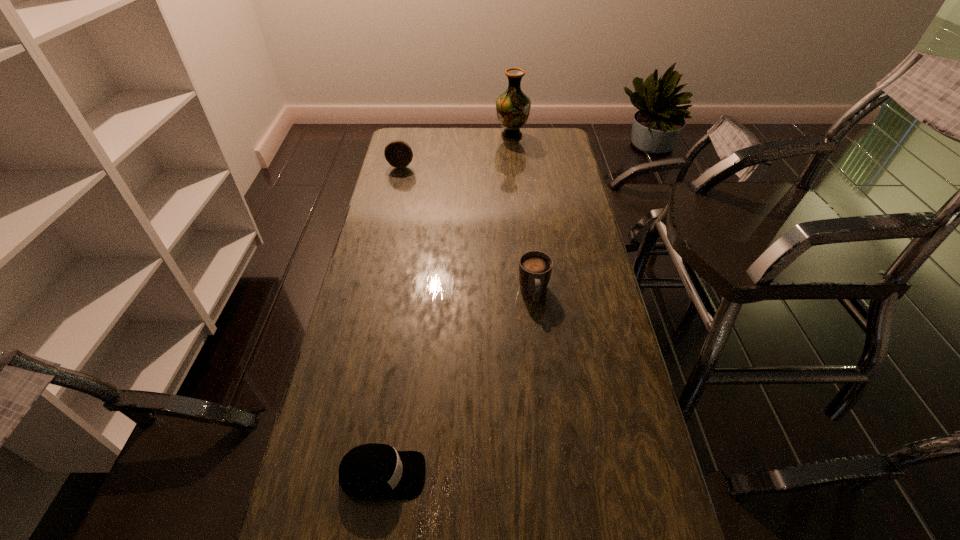
Find the location of a particular element. This screenshot has height=540, width=960. object positioned at the far edge is located at coordinates (513, 107).

This screenshot has height=540, width=960. Identify the location of bowl that is at the left edge. (398, 153).

At what (x,y) coordinates should I click in order to perform the action: click on cap that is at the left edge. Please return your answer as a coordinate pair (x, y). Looking at the image, I should click on (373, 471).

Image resolution: width=960 pixels, height=540 pixels. In the image, there is a desktop. Find the location of `free region at the left edge`. free region at the left edge is located at coordinates (422, 161).

Locate an element on the screen. Image resolution: width=960 pixels, height=540 pixels. blank space at the right edge of the desktop is located at coordinates (569, 221).

Find the location of a particular element. free space at the far right corner of the desktop is located at coordinates (536, 131).

You are a GUI agent. You are given a task and a screenshot of the screen. Output one action in this format:
    pyautogui.click(x=<x>, y=<y>)
    Task: Click on the empty location between the bowl and the cap
    Image resolution: width=960 pixels, height=540 pixels.
    Given the screenshot: What is the action you would take?
    pyautogui.click(x=392, y=320)

This screenshot has height=540, width=960. Find the location of `free space that is in between the nearest object and the vase`. free space that is in between the nearest object and the vase is located at coordinates (447, 306).

Where is `vacant space in between the shortest object and the farthest object`? The image size is (960, 540). vacant space in between the shortest object and the farthest object is located at coordinates (447, 306).

This screenshot has width=960, height=540. I want to click on unoccupied position between the cap and the vase, so click(447, 306).